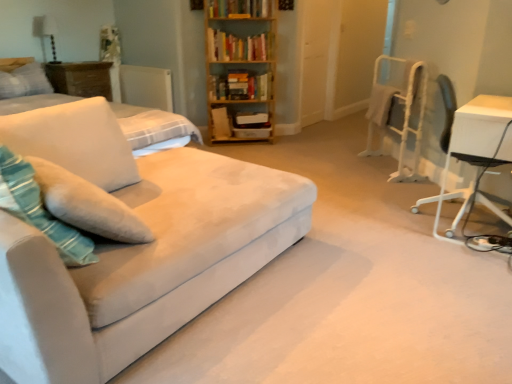
Measure the distance between point (390, 110) and camera.

The depth of point (390, 110) is 12.70 feet.

At what (x,y) coordinates should I click in order to perform the action: click on white matte radiator at upper left. Please return your answer as a coordinate pair (x, y). Looking at the image, I should click on (146, 87).

Where is `white glossy table at right, arranged as the second table when viewed from the left`? white glossy table at right, arranged as the second table when viewed from the left is located at coordinates (479, 136).

Describe the element at coordinates (479, 136) in the screenshot. This screenshot has width=512, height=384. I see `white glossy table at right, which is counted as the second table, starting from the back` at that location.

Describe the element at coordinates (240, 86) in the screenshot. I see `hardcover books at center, arranged as the 1th book when ordered from the bottom` at that location.

Find the location of `hardcover book at upper center, which appears as the first book when viewed from the top`. hardcover book at upper center, which appears as the first book when viewed from the top is located at coordinates (239, 8).

From a real-world perspective, who is located higher, white matte radiator at upper left or wooden table at left, the second table positioned from the front?

wooden table at left, the second table positioned from the front, is physically above.

From the image's perspective, between white matte radiator at upper left and wooden table at left, which is the second table in bottom-to-top order, which one is located above?

white matte radiator at upper left, from the image's perspective.

Which object is closer to the camera taking this photo, white matte radiator at upper left or wooden table at left, arranged as the first table when viewed from the left?

wooden table at left, arranged as the first table when viewed from the left.

Would you say hardcover book at upper center, which appears as the first book when viewed from the top, contains wooden bookcase at upper center?

That's incorrect, wooden bookcase at upper center is not inside hardcover book at upper center, which appears as the first book when viewed from the top.

At what (x,y) coordinates should I click in order to perform the action: click on bookcase below the hardcover book at upper center, which appears as the first book when viewed from the top (from the image's perspective). Please return your answer as a coordinate pair (x, y). Image resolution: width=512 pixels, height=384 pixels. Looking at the image, I should click on (240, 69).

Could you measure the distance between hardcover book at upper center, which appears as the first book when viewed from the top, and wooden bookcase at upper center?

They are 16.84 inches apart.

From the image's perspective, is hardcover book at upper center, which appears as the first book when viewed from the top, above or below wooden bookcase at upper center?

Clearly, from the image's perspective, hardcover book at upper center, which appears as the first book when viewed from the top, is above wooden bookcase at upper center.

Is white matte radiator at upper left with hardcover books at center, arranged as the 1th book when ordered from the bottom?

white matte radiator at upper left and hardcover books at center, arranged as the 1th book when ordered from the bottom, are clearly separated.

Is white matte radiator at upper left in front of or behind hardcover books at center, which ranks as the 3th book in top-to-bottom order, in the image?

Clearly, white matte radiator at upper left is behind hardcover books at center, which ranks as the 3th book in top-to-bottom order.

How many degrees apart are the facing directions of white matte radiator at upper left and hardcover books at center, which ranks as the 3th book in top-to-bottom order?

45.7 degrees.

Does white matte radiator at upper left contain hardcover books at center, which ranks as the 3th book in top-to-bottom order?

That's incorrect, hardcover books at center, which ranks as the 3th book in top-to-bottom order, is not inside white matte radiator at upper left.

In the scene shown: Does white soft pillow at upper left, the second pillow from the right, have a lesser height compared to soft white fabric pillow at left, marked as the first pillow in a bottom-to-top arrangement?

Yes, white soft pillow at upper left, the second pillow from the right, is shorter than soft white fabric pillow at left, marked as the first pillow in a bottom-to-top arrangement.

Is white soft pillow at upper left, positioned as the second pillow in bottom-to-top order, closer to camera compared to soft white fabric pillow at left, marked as the first pillow in a bottom-to-top arrangement?

No, white soft pillow at upper left, positioned as the second pillow in bottom-to-top order, is behind soft white fabric pillow at left, marked as the first pillow in a bottom-to-top arrangement.

Is white soft pillow at upper left, which is the second pillow in front-to-back order, turned away from soft white fabric pillow at left, the 2th pillow viewed from the top?

That's not correct — white soft pillow at upper left, which is the second pillow in front-to-back order, is not looking away from soft white fabric pillow at left, the 2th pillow viewed from the top.

From the picture: Which of these two, white soft pillow at upper left, which is the second pillow in front-to-back order, or soft white fabric pillow at left, which is the second pillow in back-to-front order, is thinner?

white soft pillow at upper left, which is the second pillow in front-to-back order.

From a real-world perspective, is white matte radiator at upper left above or below suede couch at left?

white matte radiator at upper left is situated higher than suede couch at left in the real world.

Is white matte radiator at upper left looking in the opposite direction of suede couch at left?

That's not correct — white matte radiator at upper left is not looking away from suede couch at left.

This screenshot has width=512, height=384. There is a suede couch at left. In order to click on radiator above it (from a real-world perspective) in this screenshot , I will do `click(146, 87)`.

Does white matte radiator at upper left have a greater height compared to suede couch at left?

In fact, white matte radiator at upper left may be shorter than suede couch at left.

From a real-world perspective, between suede couch at left and white plastic chair at right, who is vertically higher?

white plastic chair at right is physically above.

Is white plastic chair at right at the back of suede couch at left?

No, suede couch at left is not facing the opposite direction of white plastic chair at right.

Considering the relative positions of suede couch at left and white plastic chair at right in the image provided, is suede couch at left in front of white plastic chair at right?

Yes, suede couch at left is closer to the viewer.

How many degrees apart are the facing directions of suede couch at left and white plastic chair at right?

The facing directions of suede couch at left and white plastic chair at right are 138 degrees apart.

Where is `pillow behind the soft white fabric pillow at left, which is the second pillow in back-to-front order`? The image size is (512, 384). pillow behind the soft white fabric pillow at left, which is the second pillow in back-to-front order is located at coordinates (24, 81).

From their relative heights in the image, would you say soft white fabric pillow at left, marked as the first pillow in a bottom-to-top arrangement, is taller or shorter than white soft pillow at upper left, positioned as the second pillow in bottom-to-top order?

Considering their sizes, soft white fabric pillow at left, marked as the first pillow in a bottom-to-top arrangement, has more height than white soft pillow at upper left, positioned as the second pillow in bottom-to-top order.

From a real-world perspective, is soft white fabric pillow at left, which is the second pillow in back-to-front order, under white soft pillow at upper left, positioned as the 1th pillow in back-to-front order?

Correct, in the physical world, soft white fabric pillow at left, which is the second pillow in back-to-front order, is lower than white soft pillow at upper left, positioned as the 1th pillow in back-to-front order.

Relative to white soft pillow at upper left, positioned as the 1th pillow in back-to-front order, is soft white fabric pillow at left, the 1th pillow in the right-to-left sequence, in front or behind?

In the image, soft white fabric pillow at left, the 1th pillow in the right-to-left sequence, appears in front of white soft pillow at upper left, positioned as the 1th pillow in back-to-front order.

This screenshot has width=512, height=384. Find the location of `radiator below the wooden table at left, marked as the 1th table in a top-to-bottom arrangement (from a real-world perspective)`. radiator below the wooden table at left, marked as the 1th table in a top-to-bottom arrangement (from a real-world perspective) is located at coordinates (146, 87).

The width and height of the screenshot is (512, 384). In order to click on the 2nd book above the wooden bookcase at upper center (from the image's perspective) in this screenshot , I will do `click(239, 8)`.

When comparing their distances from wooden table at left, arranged as the first table when viewed from the left, does wooden bookcase at upper center or soft white fabric pillow at left, the 2th pillow viewed from the top, seem further?

Among the two, soft white fabric pillow at left, the 2th pillow viewed from the top, is located further to wooden table at left, arranged as the first table when viewed from the left.

Which object lies nearer to the anchor point soft white fabric pillow at left, the 1th pillow in the right-to-left sequence, white soft pillow at upper left, positioned as the 1th pillow in back-to-front order, or hardcover books at center, positioned as the 2th book in bottom-to-top order?

Among the two, white soft pillow at upper left, positioned as the 1th pillow in back-to-front order, is located nearer to soft white fabric pillow at left, the 1th pillow in the right-to-left sequence.

When comparing their distances from hardcover book at upper center, which appears as the first book when viewed from the top, does wooden table at left, which is the second table in bottom-to-top order, or hardcover books at center, positioned as the 2th book in bottom-to-top order, seem closer?

hardcover books at center, positioned as the 2th book in bottom-to-top order, is closer to hardcover book at upper center, which appears as the first book when viewed from the top.

From the image, which object appears to be nearer to white soft pillow at upper left, positioned as the 1th pillow in back-to-front order, white glossy table at right, which is counted as the second table, starting from the back, or hardcover books at center, positioned as the 2th book in bottom-to-top order?

hardcover books at center, positioned as the 2th book in bottom-to-top order, is closer to white soft pillow at upper left, positioned as the 1th pillow in back-to-front order.

Which object lies nearer to the anchor point wooden table at left, the second table positioned from the front, white matte radiator at upper left or hardcover books at center, the second book positioned from the top?

white matte radiator at upper left is closer to wooden table at left, the second table positioned from the front.

Considering their positions, is suede couch at left positioned closer to hardcover book at upper center, which is the third book from bottom to top, than hardcover books at center, which ranks as the 3th book in top-to-bottom order?

hardcover books at center, which ranks as the 3th book in top-to-bottom order, is closer to hardcover book at upper center, which is the third book from bottom to top.

When comparing their distances from white glossy table at right, the second table in the top-to-bottom sequence, does white plastic chair at right or wooden bookcase at upper center seem closer?

Based on the image, white plastic chair at right appears to be nearer to white glossy table at right, the second table in the top-to-bottom sequence.

Estimate the real-world distances between objects in this image. Which object is further from wooden table at left, marked as the 1th table in a top-to-bottom arrangement, hardcover books at center, arranged as the 1th book when ordered from the bottom, or suede couch at left?

Among the two, suede couch at left is located further to wooden table at left, marked as the 1th table in a top-to-bottom arrangement.

Locate an element on the screen. This screenshot has height=384, width=512. computer chair positioned between suede couch at left and wooden bookcase at upper center from near to far is located at coordinates (400, 113).

You are a GUI agent. You are given a task and a screenshot of the screen. Output one action in this format:
    pyautogui.click(x=<x>, y=<y>)
    Task: Click on the pillow between wooden table at left, arranged as the first table when viewed from the left, and white glossy table at right, the second table in the top-to-bottom sequence, from left to right
    This screenshot has width=512, height=384.
    Given the screenshot: What is the action you would take?
    pyautogui.click(x=75, y=140)

At what (x,y) coordinates should I click in order to perform the action: click on computer chair between suede couch at left and hardcover book at upper center, which appears as the first book when viewed from the top, along the z-axis. Please return your answer as a coordinate pair (x, y). Looking at the image, I should click on (400, 113).

The image size is (512, 384). I want to click on bookcase located between white soft pillow at upper left, the second pillow from the right, and hardcover books at center, positioned as the 2th book in bottom-to-top order, in the left-right direction, so click(x=240, y=69).